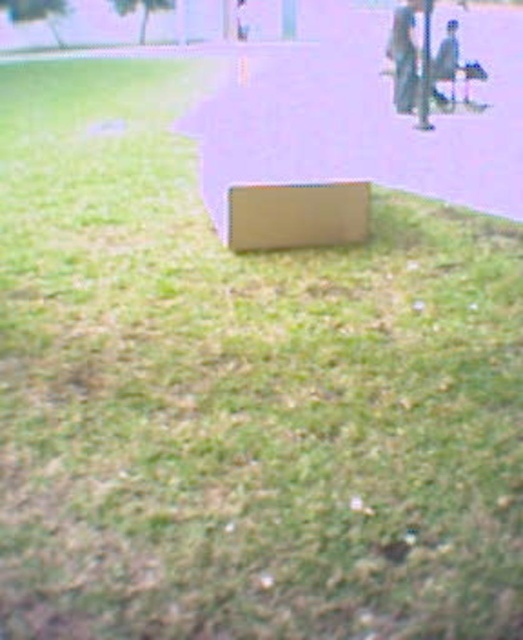
Question: Which point appears closest to the camera in this image?

Choices:
 (A) (413, 8)
 (B) (302, 212)
 (C) (447, 125)

Answer: (B)

Question: Is matte cardboard box at center above metallic silver skateboard at upper right?

Choices:
 (A) yes
 (B) no

Answer: (B)

Question: Among these objects, which one is farthest from the camera?

Choices:
 (A) brown cardboard at center
 (B) matte cardboard box at center
 (C) metallic silver skateboard at upper right

Answer: (C)

Question: Which object is closer to the camera taking this photo?

Choices:
 (A) brown cardboard at center
 (B) metallic silver skateboard at upper right

Answer: (A)

Question: Is matte cardboard box at center in front of metallic silver skateboard at upper right?

Choices:
 (A) yes
 (B) no

Answer: (A)

Question: Does brown cardboard at center have a smaller size compared to metallic silver skateboard at upper right?

Choices:
 (A) no
 (B) yes

Answer: (A)